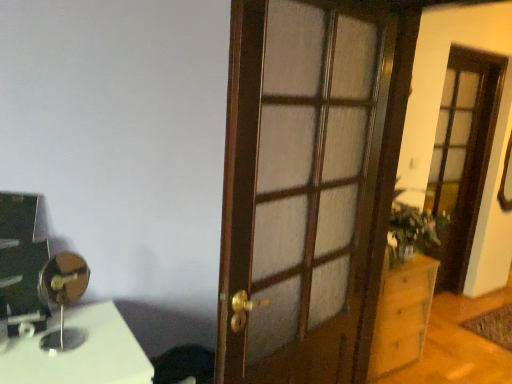
What is the approximate width of green leafy plant at right?

10.30 inches.

Image resolution: width=512 pixels, height=384 pixels. In order to click on wooden cabinet at right in this screenshot , I will do click(402, 315).

What do you see at coordinates (308, 182) in the screenshot?
I see `wooden door at center` at bounding box center [308, 182].

Identify the location of wooden screen door at right. Image resolution: width=512 pixels, height=384 pixels. (463, 155).

This screenshot has width=512, height=384. What do you see at coordinates (184, 365) in the screenshot? I see `black leather swivel chair at lower left` at bounding box center [184, 365].

In order to click on green leafy plant at right in this screenshot , I will do `click(414, 231)`.

Identify the location of cabinetry below the green leafy plant at right (from a real-world perspective). (402, 315).

Looking at their sizes, would you say green leafy plant at right is wider or thinner than wooden cabinet at right?

green leafy plant at right is thinner than wooden cabinet at right.

What's the angular difference between green leafy plant at right and wooden cabinet at right's facing directions?

0.00167 degrees separate the facing orientations of green leafy plant at right and wooden cabinet at right.

Which of these two, wooden door at center or green leafy plant at right, is bigger?

With larger size is wooden door at center.

Looking at this image, does wooden door at center have a greater width compared to green leafy plant at right?

In fact, wooden door at center might be narrower than green leafy plant at right.

Based on the photo, can you confirm if wooden door at center is positioned to the left of green leafy plant at right?

Yes.

Which is less distant, [357,348] or [426,213]?

Clearly, point [357,348] is closer to the camera than point [426,213].

Who is smaller, metallic gold table lamp at left or wooden cabinet at right?

Smaller between the two is metallic gold table lamp at left.

Is metallic gold table lamp at left to the right of wooden cabinet at right from the viewer's perspective?

In fact, metallic gold table lamp at left is to the left of wooden cabinet at right.

Between metallic gold table lamp at left and wooden cabinet at right, which one has more height?

With more height is wooden cabinet at right.

Looking at this image, from a real-world perspective, relative to wooden screen door at right, is green leafy plant at right vertically above or below?

From a real-world perspective, green leafy plant at right is physically below wooden screen door at right.

Is green leafy plant at right further to camera compared to wooden screen door at right?

No.

Consider the image. Measure the distance between green leafy plant at right and wooden screen door at right.

green leafy plant at right is 1.05 meters from wooden screen door at right.

The height and width of the screenshot is (384, 512). Find the location of `screen door that is behind the green leafy plant at right`. screen door that is behind the green leafy plant at right is located at coordinates (463, 155).

Where is `cabinetry that appears below the wooden screen door at right (from a real-world perspective)`? The image size is (512, 384). cabinetry that appears below the wooden screen door at right (from a real-world perspective) is located at coordinates (402, 315).

Is wooden cabinet at right inside or outside of wooden screen door at right?

wooden cabinet at right cannot be found inside wooden screen door at right.

Considering the points (406, 316) and (451, 230), which point is in front, point (406, 316) or point (451, 230)?

The point (406, 316) is more forward.

From the picture: Between green leafy plant at right and metallic gold table lamp at left, which one has larger width?

green leafy plant at right is wider.

Is green leafy plant at right directly adjacent to metallic gold table lamp at left?

green leafy plant at right and metallic gold table lamp at left are not in contact.

Is green leafy plant at right oriented towards metallic gold table lamp at left?

No, green leafy plant at right is not turned towards metallic gold table lamp at left.

From a real-world perspective, is green leafy plant at right positioned above or below metallic gold table lamp at left?

Clearly, from a real-world perspective, green leafy plant at right is below metallic gold table lamp at left.

From a real-world perspective, is black leather swivel chair at lower left below metallic gold table lamp at left?

Indeed, from a real-world perspective, black leather swivel chair at lower left is positioned beneath metallic gold table lamp at left.

From the image's perspective, is black leather swivel chair at lower left above or below metallic gold table lamp at left?

black leather swivel chair at lower left is below metallic gold table lamp at left.

In the image, is black leather swivel chair at lower left positioned in front of or behind metallic gold table lamp at left?

black leather swivel chair at lower left is positioned farther from the viewer than metallic gold table lamp at left.

Locate an element on the screen. The width and height of the screenshot is (512, 384). houseplant on the right of wooden cabinet at right is located at coordinates (414, 231).

Image resolution: width=512 pixels, height=384 pixels. Identify the location of door above the green leafy plant at right (from the image's perspective). (308, 182).

Based on their spatial positions, is green leafy plant at right or metallic gold table lamp at left closer to black leather swivel chair at lower left?

metallic gold table lamp at left.

When comparing their distances from wooden cabinet at right, does black leather swivel chair at lower left or green leafy plant at right seem closer?

The object closer to wooden cabinet at right is green leafy plant at right.

From the image, which object appears to be nearer to wooden cabinet at right, green leafy plant at right or metallic gold table lamp at left?

green leafy plant at right.

Which object lies nearer to the anchor point wooden screen door at right, wooden cabinet at right or green leafy plant at right?

green leafy plant at right lies closer to wooden screen door at right than the other object.

Based on their spatial positions, is black leather swivel chair at lower left or metallic gold table lamp at left closer to wooden door at center?

black leather swivel chair at lower left.

Estimate the real-world distances between objects in this image. Which object is closer to wooden door at center, metallic gold table lamp at left or black leather swivel chair at lower left?

black leather swivel chair at lower left is positioned closer to the anchor wooden door at center.

When comparing their distances from wooden screen door at right, does green leafy plant at right or wooden cabinet at right seem further?

The object further to wooden screen door at right is wooden cabinet at right.

When comparing their distances from wooden cabinet at right, does green leafy plant at right or wooden door at center seem further?

wooden door at center lies further to wooden cabinet at right than the other object.

The width and height of the screenshot is (512, 384). In order to click on houseplant located between metallic gold table lamp at left and wooden screen door at right in the left-right direction in this screenshot , I will do `click(414, 231)`.

This screenshot has width=512, height=384. In order to click on door located between black leather swivel chair at lower left and wooden screen door at right in the left-right direction in this screenshot , I will do `click(308, 182)`.

Where is `cabinetry between wooden door at center and green leafy plant at right in the front-back direction`? The width and height of the screenshot is (512, 384). cabinetry between wooden door at center and green leafy plant at right in the front-back direction is located at coordinates (402, 315).

You are a GUI agent. You are given a task and a screenshot of the screen. Output one action in this format:
    pyautogui.click(x=<x>, y=<y>)
    Task: Click on the houseplant between wooden screen door at right and wooden cabinet at right in the vertical direction
    This screenshot has width=512, height=384.
    Given the screenshot: What is the action you would take?
    pyautogui.click(x=414, y=231)